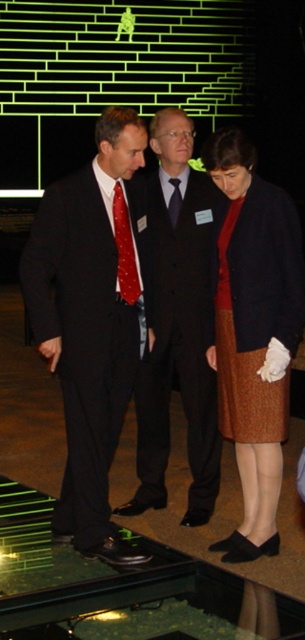
You are a photographer standing at the camera position. You want to take a photo of the brown textured skirt at right. Can you adjust your camera position to be closer than 3 meters away without moving the skirt?

The brown textured skirt at right and camera are 3.50 meters apart from each other. To be closer than 3 meters, you would need to move the camera 0.5 meters closer to the skirt, but since the question states not to move the skirt, you can adjust your camera position to be within 3 meters by moving it forward.